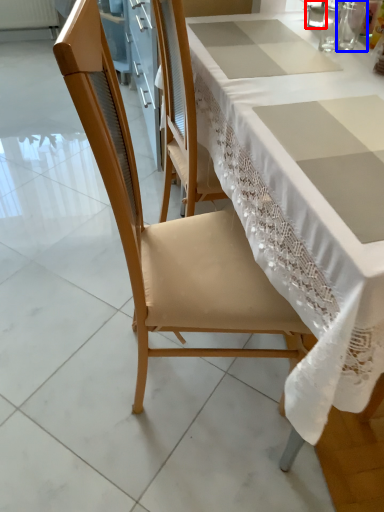
Question: Which object appears closest to the camera in this image, tableware (highlighted by a red box) or tableware (highlighted by a blue box)?

Choices:
 (A) tableware
 (B) tableware

Answer: (B)